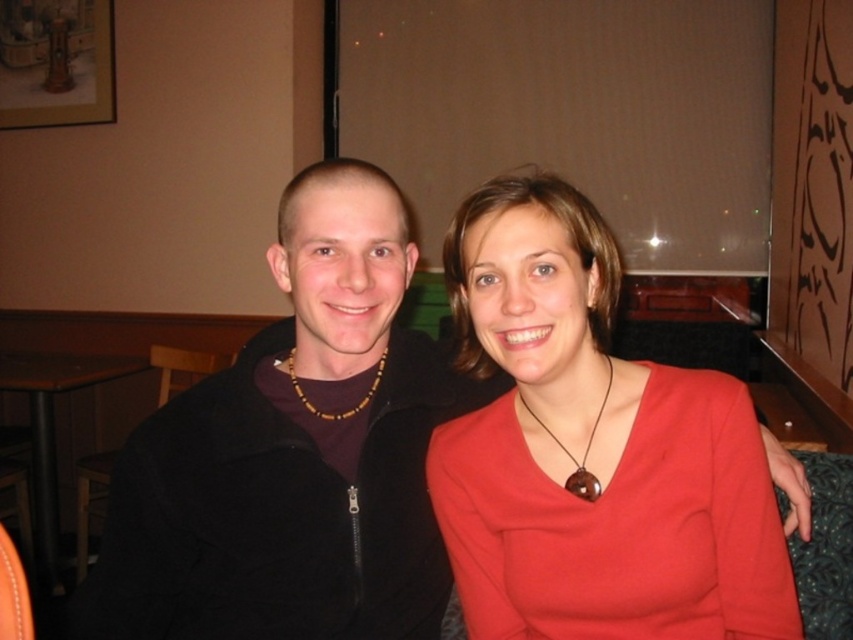
Does brown wood pendant at center appear on the right side of brown wooden beads at center?

Correct, you'll find brown wood pendant at center to the right of brown wooden beads at center.

Between brown wood pendant at center and brown wooden beads at center, which one has less height?

brown wooden beads at center is shorter.

Describe the element at coordinates (583, 451) in the screenshot. I see `brown wood pendant at center` at that location.

The image size is (853, 640). What are the coordinates of `brown wood pendant at center` in the screenshot? It's located at (583, 451).

Who is higher up, matte red blouse at center or brown wooden beads at center?

brown wooden beads at center

Who is positioned more to the left, matte red blouse at center or brown wooden beads at center?

brown wooden beads at center is more to the left.

Is point (668, 404) more distant than point (370, 394)?

No, (668, 404) is in front of (370, 394).

The height and width of the screenshot is (640, 853). I want to click on matte red blouse at center, so [x=590, y=449].

Which of these two, matte red blouse at center or brown wooden table at lower left, stands taller?

With more height is brown wooden table at lower left.

Can you confirm if matte red blouse at center is shorter than brown wooden table at lower left?

Yes, matte red blouse at center is shorter than brown wooden table at lower left.

I want to click on matte red blouse at center, so click(x=590, y=449).